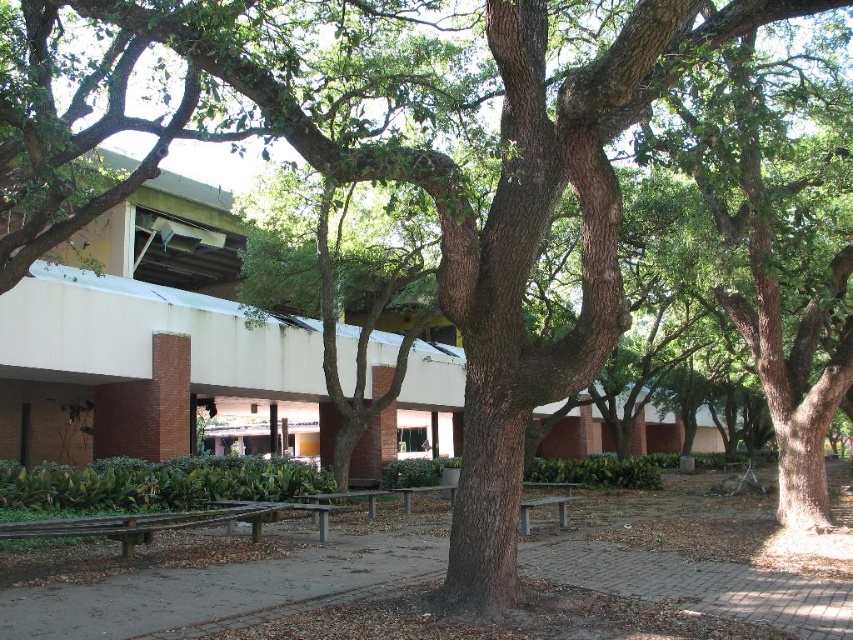
Question: Which point is closer to the camera?

Choices:
 (A) (312, 496)
 (B) (451, 492)
 (C) (529, 504)

Answer: (C)

Question: Can you confirm if gray wood park bench at center is positioned above wooden park bench at center?

Choices:
 (A) no
 (B) yes

Answer: (B)

Question: Considering the relative positions of wooden bench at center and gray wood park bench at center in the image provided, where is wooden bench at center located with respect to gray wood park bench at center?

Choices:
 (A) above
 (B) below

Answer: (A)

Question: Which object is positioned farthest from the wooden park bench at center?

Choices:
 (A) wooden bench at center
 (B) gray wood park bench at center

Answer: (A)

Question: Does gray wood park bench at center come behind wooden park bench at center?

Choices:
 (A) yes
 (B) no

Answer: (B)

Question: Which of the following is the closest to the observer?

Choices:
 (A) (408, 493)
 (B) (527, 508)
 (C) (370, 513)

Answer: (B)